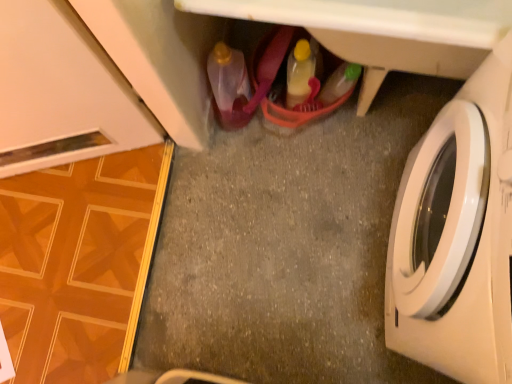
Question: Considering the relative sizes of smooth gray concrete at center and white plastic cabinet at center in the image provided, is smooth gray concrete at center bigger than white plastic cabinet at center?

Choices:
 (A) no
 (B) yes

Answer: (A)

Question: Considering the relative sizes of smooth gray concrete at center and white plastic cabinet at center in the image provided, is smooth gray concrete at center taller than white plastic cabinet at center?

Choices:
 (A) no
 (B) yes

Answer: (A)

Question: Does smooth gray concrete at center have a lesser width compared to white plastic cabinet at center?

Choices:
 (A) no
 (B) yes

Answer: (A)

Question: Is smooth gray concrete at center not inside white plastic cabinet at center?

Choices:
 (A) no
 (B) yes

Answer: (B)

Question: Is the position of smooth gray concrete at center more distant than that of white plastic cabinet at center?

Choices:
 (A) no
 (B) yes

Answer: (B)

Question: Is smooth gray concrete at center closer to the viewer compared to white plastic cabinet at center?

Choices:
 (A) yes
 (B) no

Answer: (B)

Question: Is smooth gray concrete at center closer to the viewer compared to translucent plastic bottle at lower center, which is the 1th bottle in left-to-right order?

Choices:
 (A) no
 (B) yes

Answer: (A)

Question: Is the position of smooth gray concrete at center more distant than that of translucent plastic bottle at lower center, which is the 1th bottle in left-to-right order?

Choices:
 (A) no
 (B) yes

Answer: (B)

Question: Would you consider smooth gray concrete at center to be distant from translucent plastic bottle at lower center, arranged as the 2th bottle when viewed from the right?

Choices:
 (A) yes
 (B) no

Answer: (B)

Question: Is smooth gray concrete at center at the left side of translucent plastic bottle at lower center, which is the 1th bottle in left-to-right order?

Choices:
 (A) yes
 (B) no

Answer: (B)

Question: Is smooth gray concrete at center to the right of translucent plastic bottle at lower center, arranged as the 2th bottle when viewed from the right, from the viewer's perspective?

Choices:
 (A) yes
 (B) no

Answer: (A)

Question: Is smooth gray concrete at center not within translucent plastic bottle at lower center, arranged as the 2th bottle when viewed from the right?

Choices:
 (A) no
 (B) yes

Answer: (B)

Question: Can you confirm if translucent plastic bottle at lower center, which is the 1th bottle in left-to-right order, is positioned to the left of white plastic cabinet at center?

Choices:
 (A) yes
 (B) no

Answer: (A)